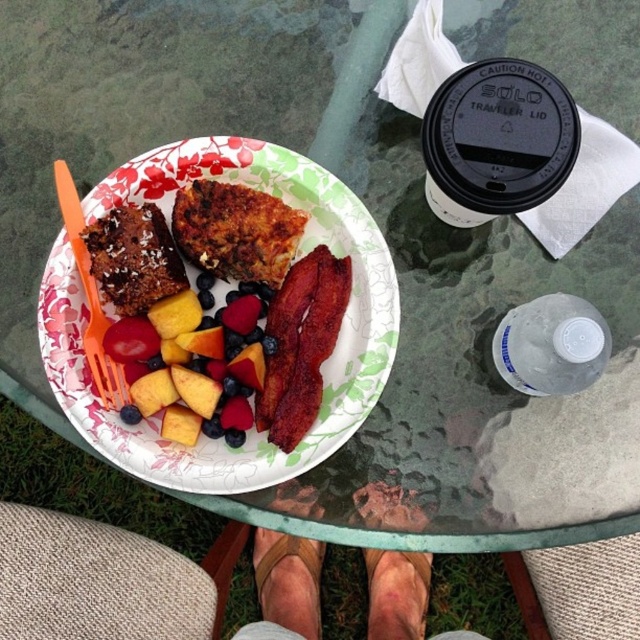
Question: Which point is closer to the camera?

Choices:
 (A) orange plastic fork at upper left
 (B) juicy peach slices at center
 (C) matte paper plate at center
 (D) golden brown crispy hash brown at center

Answer: (B)

Question: Does juicy peach slices at center come in front of chocolate cake at left?

Choices:
 (A) no
 (B) yes

Answer: (A)

Question: Considering the real-world distances, which object is farthest from the golden brown crispy hash brown at center?

Choices:
 (A) brown crispy bacon at center
 (B) clear plastic bottle at lower right

Answer: (B)

Question: Does golden brown crispy hash brown at center appear over clear plastic bottle at lower right?

Choices:
 (A) yes
 (B) no

Answer: (A)

Question: Observing the image, what is the correct spatial positioning of golden brown crispy hash brown at center in reference to clear plastic bottle at lower right?

Choices:
 (A) above
 (B) below

Answer: (A)

Question: Which point appears farthest from the camera in this image?

Choices:
 (A) (129, 387)
 (B) (580, 381)
 (C) (227, 330)
 (D) (228, 145)

Answer: (C)